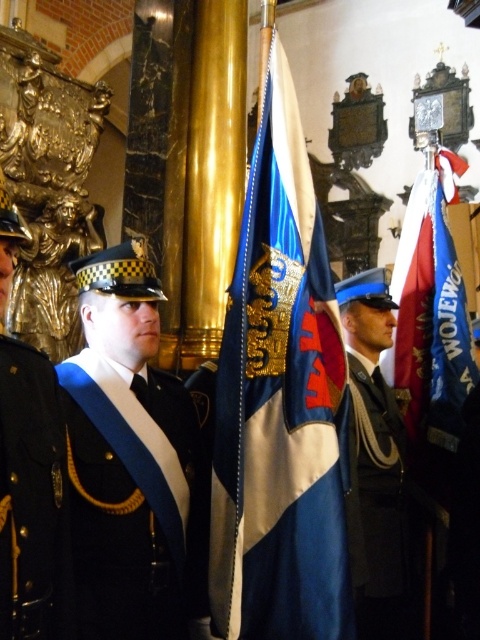
Question: Is shiny blue sash at center wider than blue fabric flag at right?

Choices:
 (A) yes
 (B) no

Answer: (B)

Question: Which object is closer to the camera taking this photo?

Choices:
 (A) blue fabric flag at center
 (B) shiny blue sash at center

Answer: (B)

Question: Which point appears closest to the camera in this image?

Choices:
 (A) (25, 566)
 (B) (202, 481)
 (C) (424, 358)
 (D) (320, 500)

Answer: (A)

Question: Does shiny blue sash at center appear on the right side of blue fabric flag at right?

Choices:
 (A) no
 (B) yes

Answer: (A)

Question: Which object is positioned farthest from the blue fabric flag at center?

Choices:
 (A) black leather uniform at center
 (B) blue fabric flag at right
 (C) shiny black uniform at center
 (D) shiny blue sash at center

Answer: (B)

Question: Does blue fabric flag at center appear over shiny blue sash at center?

Choices:
 (A) no
 (B) yes

Answer: (B)